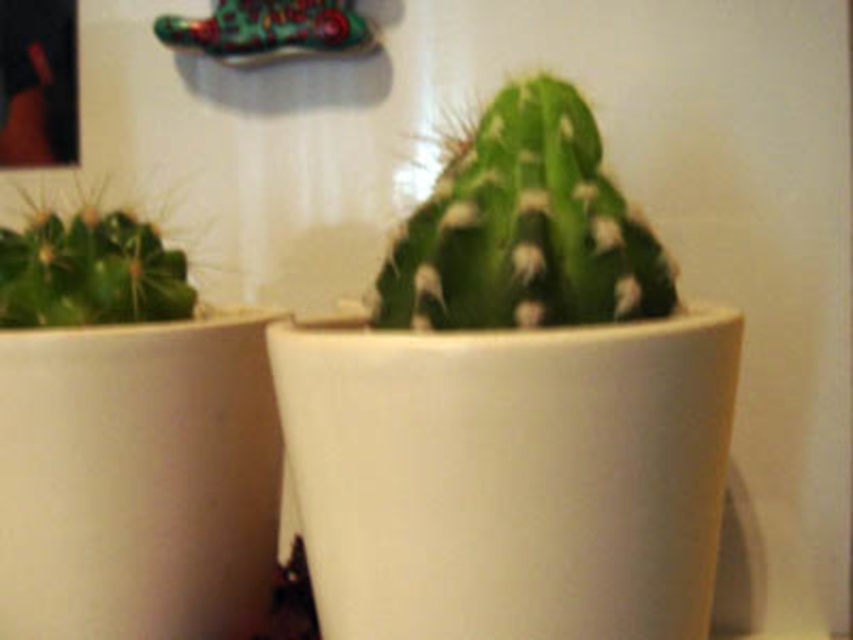
Question: Which object appears farthest from the camera in this image?

Choices:
 (A) green matte cactus at center
 (B) green matte cactus at left

Answer: (B)

Question: Is green matte cactus at center further to camera compared to green matte cactus at left?

Choices:
 (A) yes
 (B) no

Answer: (B)

Question: Which point is farther to the camera?

Choices:
 (A) green matte cactus at center
 (B) green matte cactus at left

Answer: (B)

Question: Where is green matte cactus at center located in relation to green matte cactus at left in the image?

Choices:
 (A) right
 (B) left

Answer: (A)

Question: Among these objects, which one is nearest to the camera?

Choices:
 (A) green matte cactus at center
 (B) green matte cactus at left

Answer: (A)

Question: From the image, what is the correct spatial relationship of green matte cactus at center in relation to green matte cactus at left?

Choices:
 (A) right
 (B) left

Answer: (A)